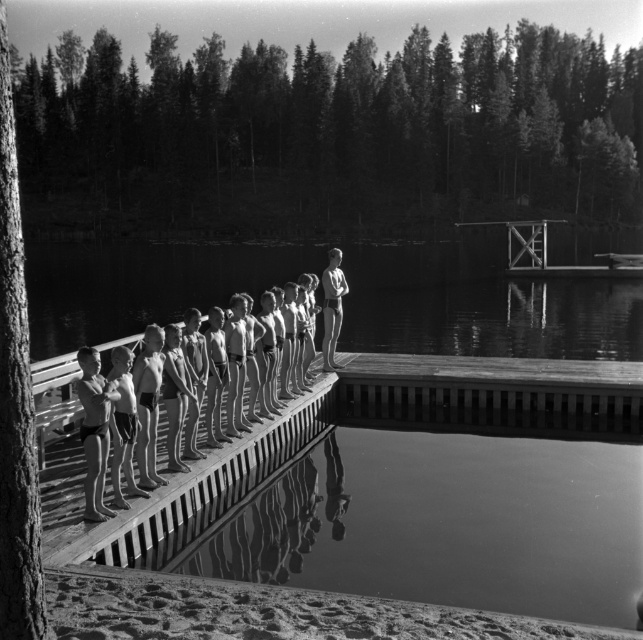
Is smooth skin children at center taller than smooth skin boy at center?

Incorrect, smooth skin children at center's height is not larger of smooth skin boy at center's.

Between smooth skin children at center and smooth skin boy at center, which one is positioned lower?

Positioned lower is smooth skin children at center.

Does point (132, 372) come closer to viewer compared to point (332, 291)?

Yes, point (132, 372) is closer to viewer.

This screenshot has height=640, width=643. I want to click on smooth skin children at center, so click(161, 401).